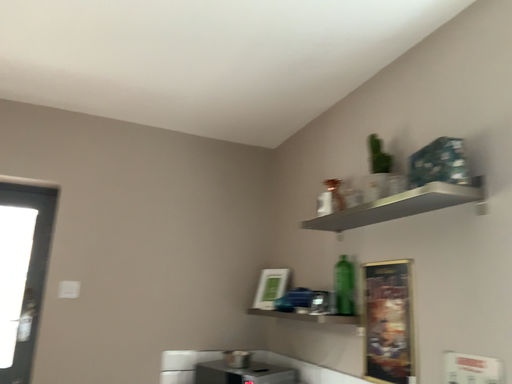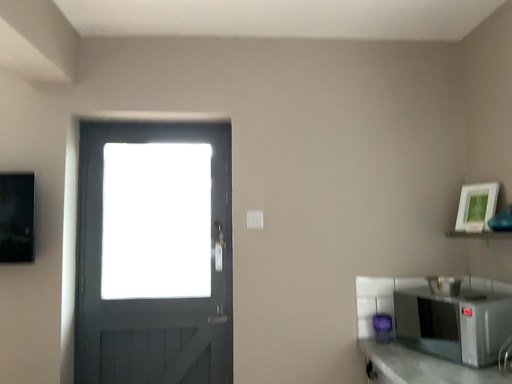
Question: How did the camera likely rotate when shooting the video?

Choices:
 (A) rotated left
 (B) rotated right

Answer: (A)